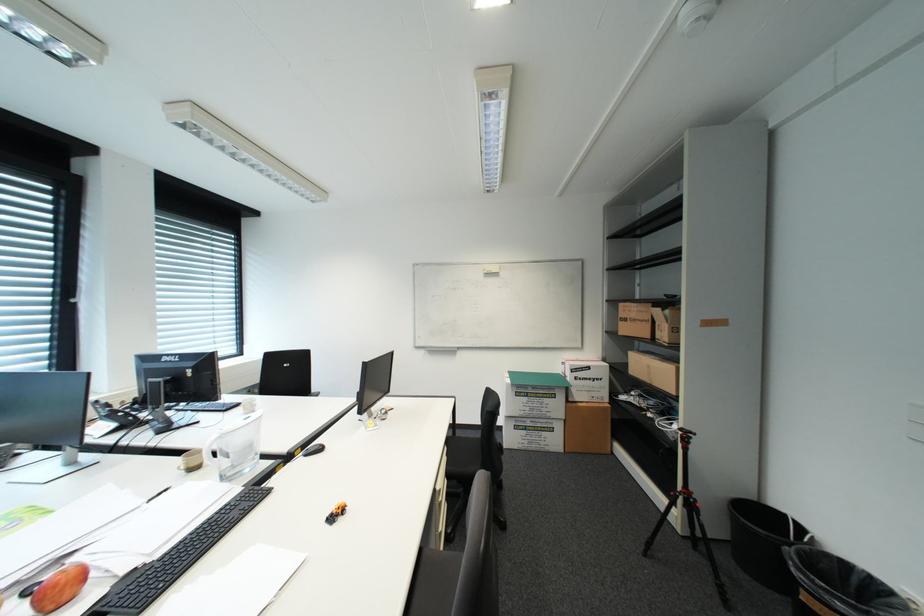
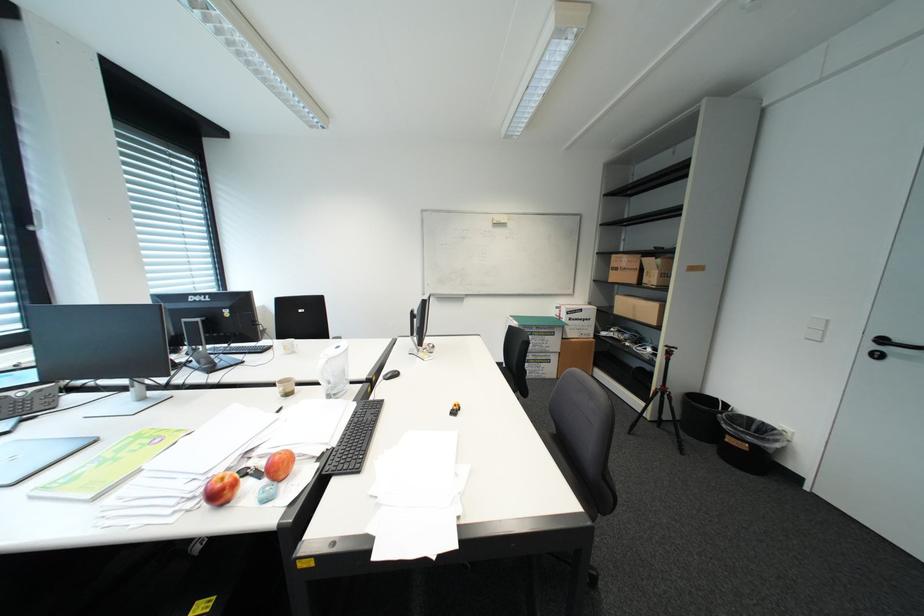
Question: The images are taken continuously from a first-person perspective. In which direction is your viewpoint rotating?

Choices:
 (A) Left
 (B) Right
 (C) Up
 (D) Down

Answer: (B)